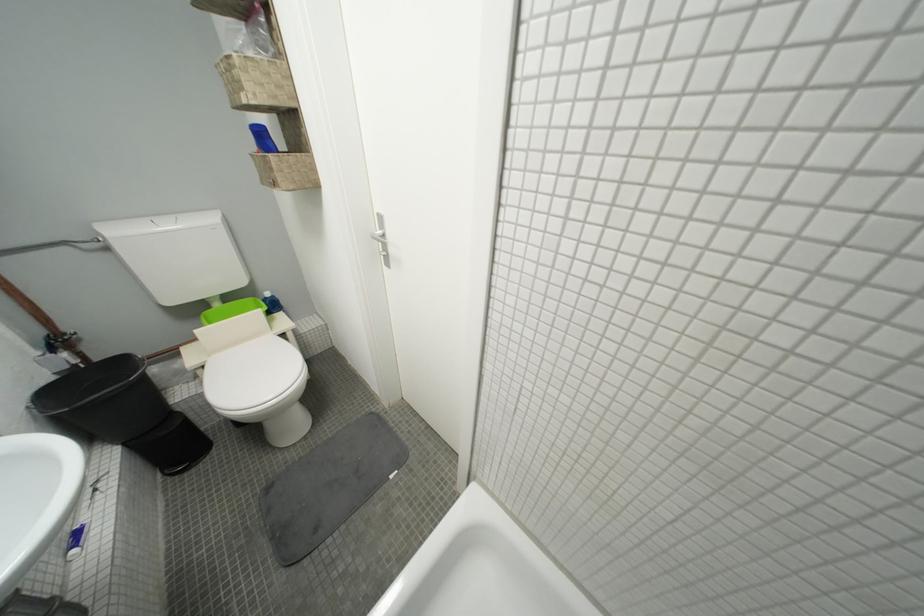
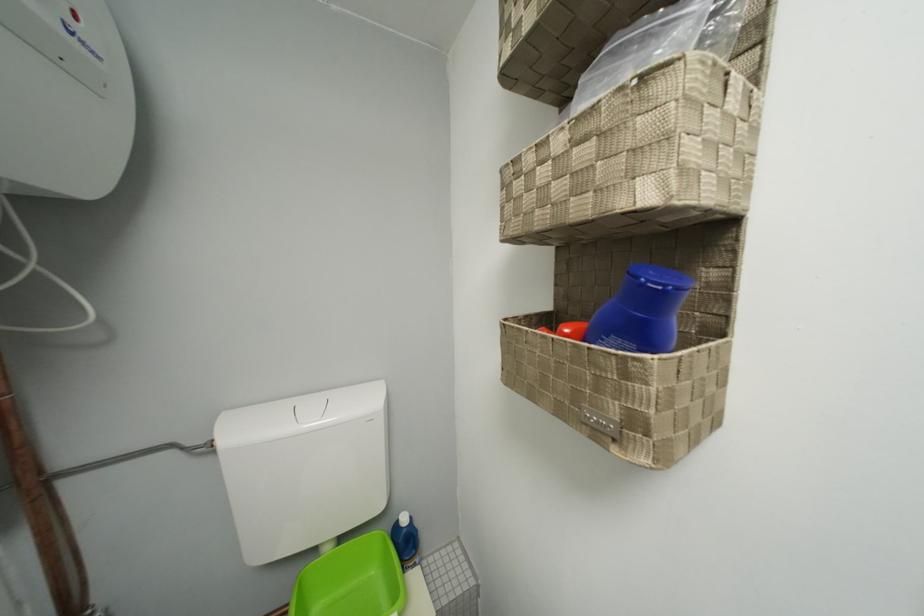
Find the pixel in the second image that matches the point at 226,307 in the first image.

(335, 552)